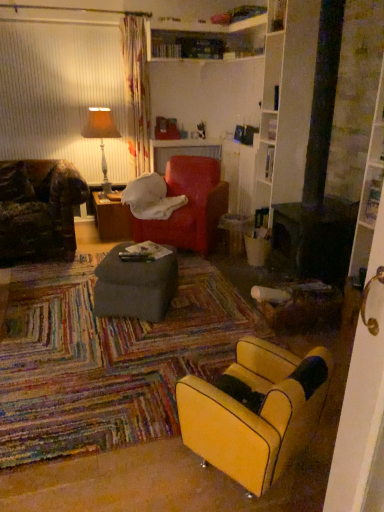
At what (x,y) coordinates should I click in order to perform the action: click on free space above matte gray ottoman at center, which appears as the second table when viewed from the top (from a real-world perspective). Please return your answer as a coordinate pair (x, y). Looking at the image, I should click on (136, 256).